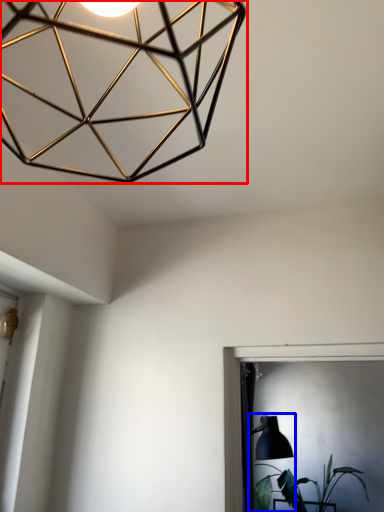
Question: Which object appears farthest to the camera in this image, lamp (highlighted by a red box) or table lamp (highlighted by a blue box)?

Choices:
 (A) lamp
 (B) table lamp

Answer: (B)